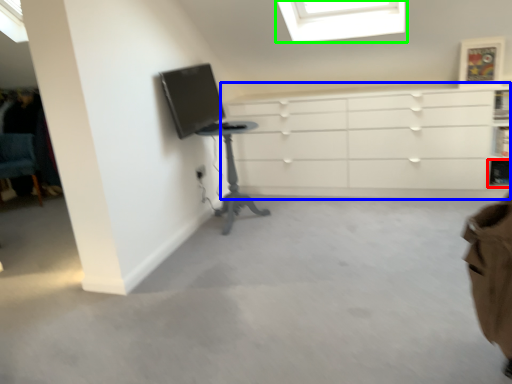
Question: Which object is the closest to the shelf (highlighted by a red box)? Choose among these: chest of drawers (highlighted by a blue box) or window (highlighted by a green box).

Choices:
 (A) chest of drawers
 (B) window

Answer: (A)